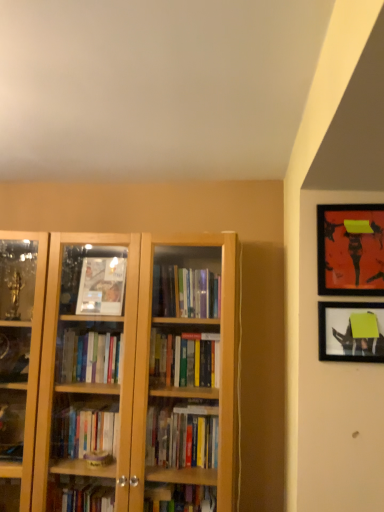
Question: From the image's perspective, is matte black picture frame at upper right, the first picture frame positioned from the bottom, positioned above or below matte black picture frame at upper right, the 1th picture frame positioned from the top?

Choices:
 (A) below
 (B) above

Answer: (A)

Question: In terms of size, does matte black picture frame at upper right, the 2th picture frame positioned from the top, appear bigger or smaller than matte black picture frame at upper right, the 1th picture frame positioned from the top?

Choices:
 (A) small
 (B) big

Answer: (A)

Question: From a real-world perspective, is matte black picture frame at upper right, the 2th picture frame positioned from the top, physically located above or below matte black picture frame at upper right, the 1th picture frame positioned from the top?

Choices:
 (A) above
 (B) below

Answer: (B)

Question: Would you say matte black picture frame at upper right, which is the second picture frame from bottom to top, is to the left or to the right of matte black picture frame at upper right, the 2th picture frame positioned from the top, in the picture?

Choices:
 (A) left
 (B) right

Answer: (B)

Question: Relative to matte black picture frame at upper right, the first picture frame positioned from the bottom, is matte black picture frame at upper right, which is the second picture frame from bottom to top, in front or behind?

Choices:
 (A) front
 (B) behind

Answer: (A)

Question: From the image's perspective, is matte black picture frame at upper right, which is the second picture frame from bottom to top, positioned above or below matte black picture frame at upper right, the first picture frame positioned from the bottom?

Choices:
 (A) below
 (B) above

Answer: (B)

Question: Is point (362, 290) positioned closer to the camera than point (382, 344)?

Choices:
 (A) farther
 (B) closer

Answer: (A)